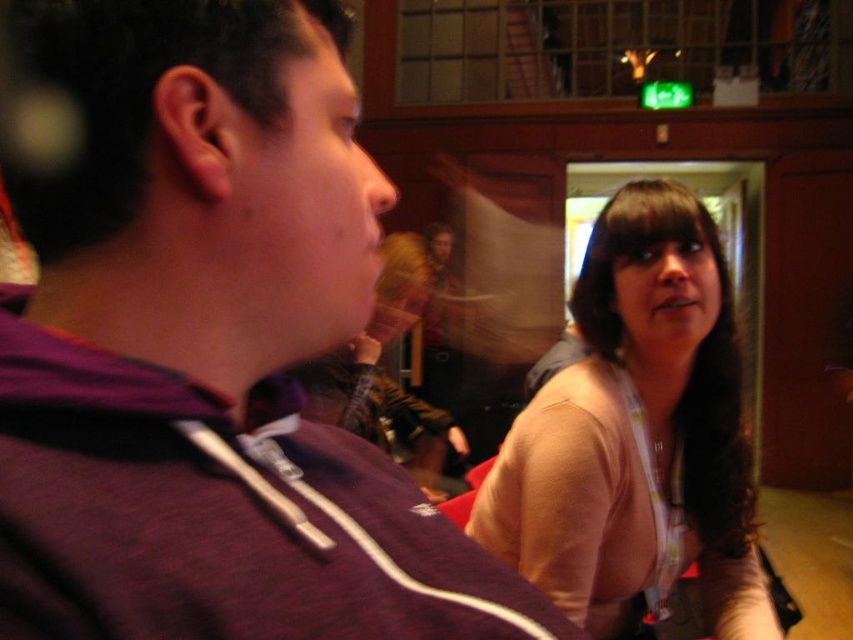
You are holding a 30 cm wide object and want to place it on the table in front of you. The table is exactly at the point labeled point (131, 108). Can you fit the object on the table without it overhanging?

The point (131, 108) is 36.69 centimeters from the camera. Since the object is only 30 centimeters wide, it will fit on the table without overhanging because the distance is greater than the object width.

You are an event organizer arranging seating for attendees. You notice two people in the front row wearing the purple fleece at center and the light beige sweater at center. Which clothing item is covering part of the other?

The purple fleece at center is positioned over the light beige sweater at center, so it is covering part of it.

You are standing in the same room and want to see both the purple fleece at center and the light beige sweater at center clearly. Which one is closer to you?

The purple fleece at center is closer to you because it is in front of the light beige sweater at center.